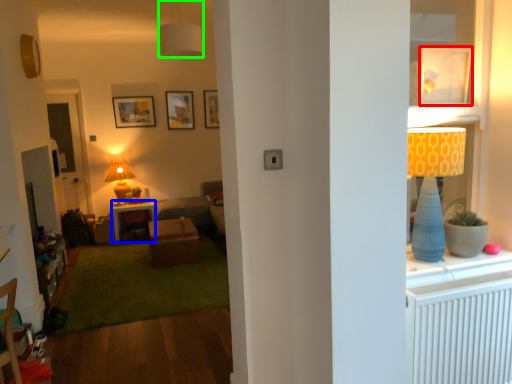
Question: Estimate the real-world distances between objects in this image. Which object is farther from picture frame (highlighted by a red box), desk (highlighted by a blue box) or lamp (highlighted by a green box)?

Choices:
 (A) desk
 (B) lamp

Answer: (A)